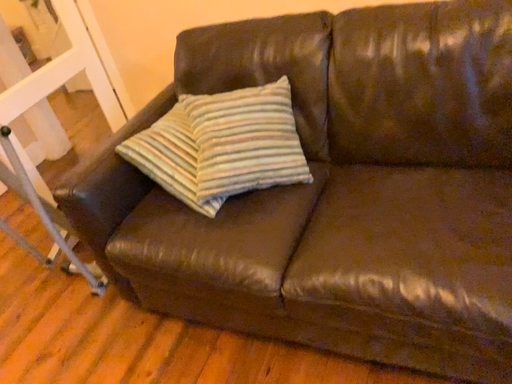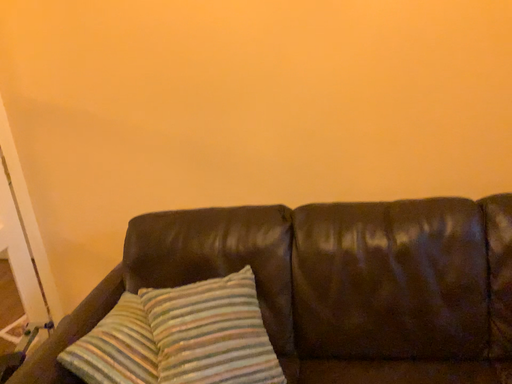
Question: How did the camera likely rotate when shooting the video?

Choices:
 (A) rotated left
 (B) rotated right

Answer: (B)